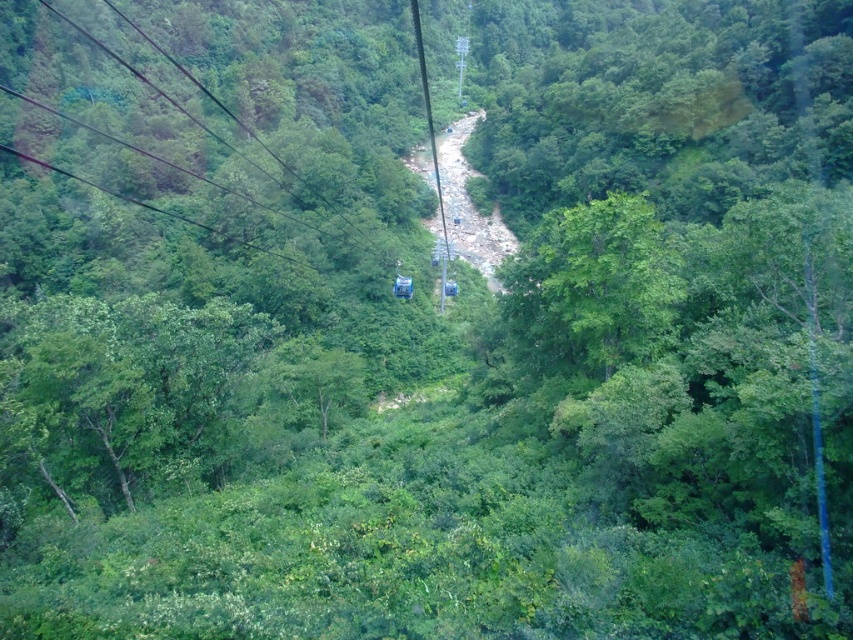
Question: Is black wire at upper left thinner than metallic wire at center?

Choices:
 (A) yes
 (B) no

Answer: (B)

Question: Among these points, which one is nearest to the camera?

Choices:
 (A) (537, 269)
 (B) (164, 156)
 (C) (448, 259)

Answer: (A)

Question: Does black wire at upper left appear over green leafy tree at center?

Choices:
 (A) no
 (B) yes

Answer: (B)

Question: Can you confirm if black wire at upper left is wider than metallic wire at center?

Choices:
 (A) yes
 (B) no

Answer: (A)

Question: Among these points, which one is farthest from the camera?

Choices:
 (A) (254, 156)
 (B) (625, 252)
 (C) (428, 109)

Answer: (C)

Question: Estimate the real-world distances between objects in this image. Which object is farther from the green leafy tree at center?

Choices:
 (A) metallic wire at center
 (B) black wire at upper left

Answer: (B)